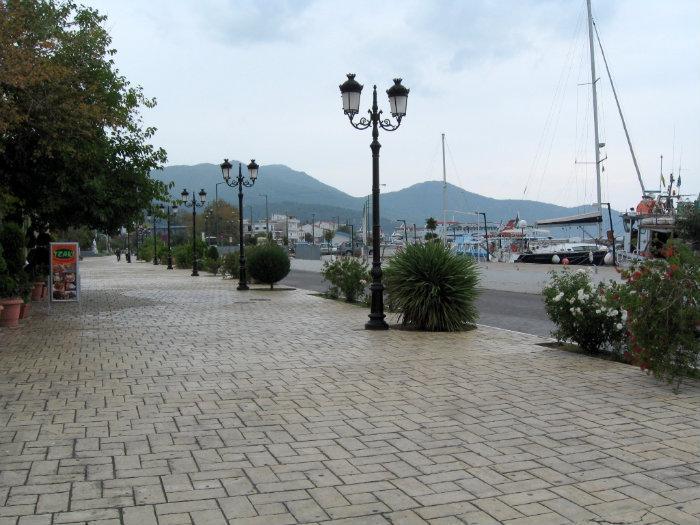
Image resolution: width=700 pixels, height=525 pixels. In order to click on lamps in this screenshot , I will do `click(400, 100)`, `click(349, 97)`, `click(222, 171)`, `click(253, 169)`, `click(185, 193)`, `click(203, 193)`, `click(172, 210)`.